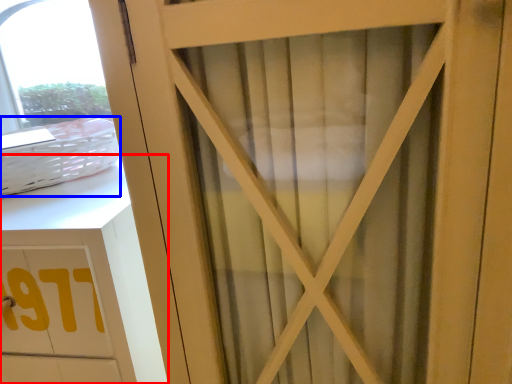
Question: Which object appears farthest to the camera in this image, cabinetry (highlighted by a red box) or basket (highlighted by a blue box)?

Choices:
 (A) cabinetry
 (B) basket

Answer: (B)